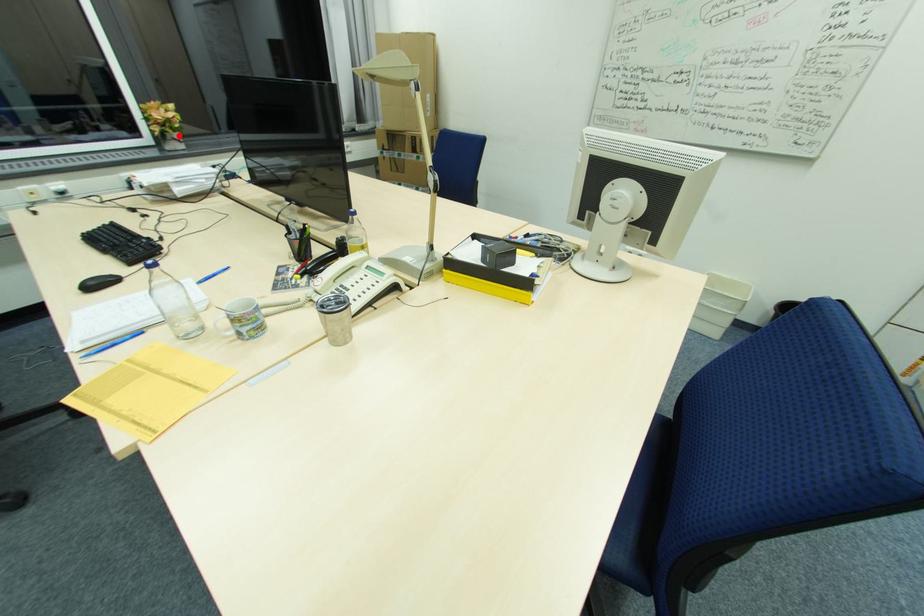
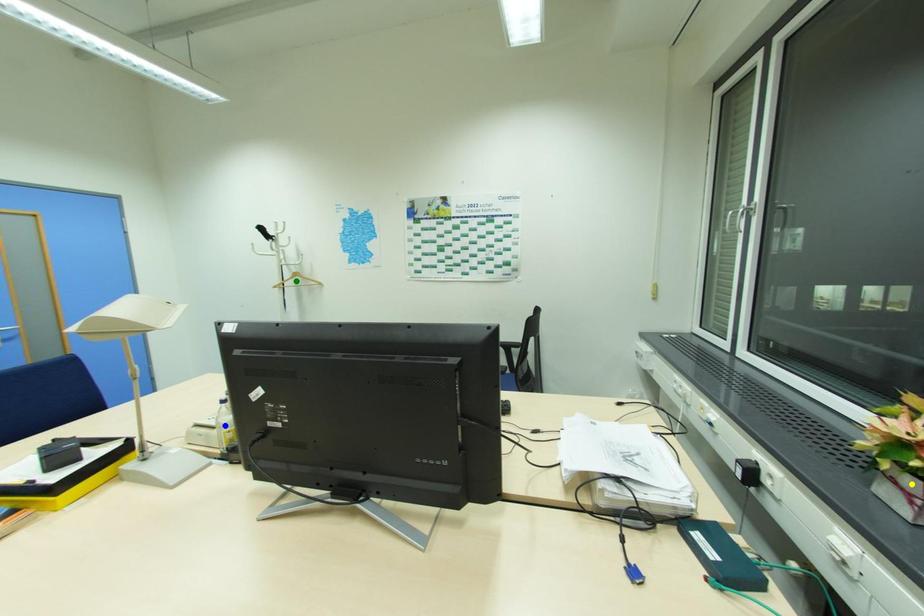
Question: I am providing you with two images of the same scene from different viewpoints. A red point is marked on the first image. You are given multiple points on the second image. Which mark in image 2 goes with the point in image 1?

Choices:
 (A) blue point
 (B) green point
 (C) yellow point

Answer: (C)